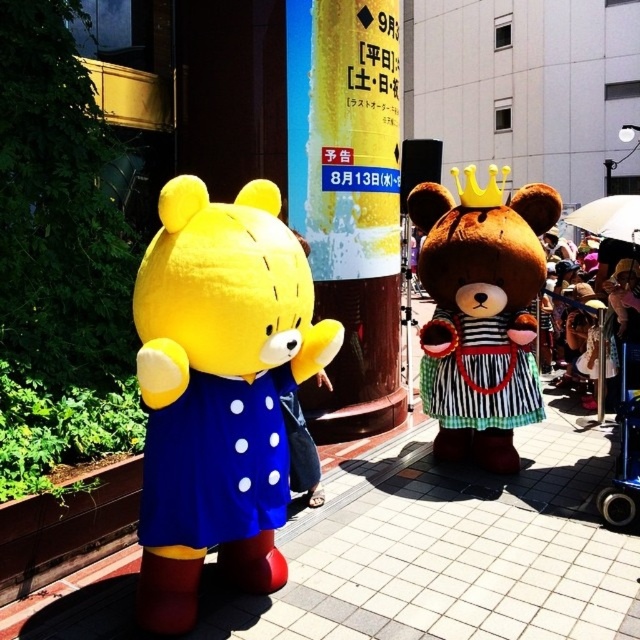
Does yellow plush bear at left appear on the left side of blue metallic baby carriage at lower right?

Indeed, yellow plush bear at left is positioned on the left side of blue metallic baby carriage at lower right.

Is yellow plush bear at left below blue metallic baby carriage at lower right?

Indeed, yellow plush bear at left is positioned under blue metallic baby carriage at lower right.

Between point (236, 582) and point (632, 268), which one is positioned in front?

Point (236, 582) is more forward.

You are a GUI agent. You are given a task and a screenshot of the screen. Output one action in this format:
    pyautogui.click(x=<x>, y=<y>)
    Task: Click on the yellow plush bear at left
    
    Given the screenshot: What is the action you would take?
    pyautogui.click(x=218, y=390)

Who is positioned more to the right, yellow plush bear at left or blue fabric dress at left?

Positioned to the right is yellow plush bear at left.

At what (x,y) coordinates should I click in order to perform the action: click on yellow plush bear at left. Please return your answer as a coordinate pair (x, y). Looking at the image, I should click on (218, 390).

Find the location of a particular element. This screenshot has width=640, height=640. yellow plush bear at left is located at coordinates (218, 390).

Describe the element at coordinates (451, 548) in the screenshot. I see `smooth concrete pavement at center` at that location.

Can you confirm if smooth concrete pavement at center is wider than blue metallic baby carriage at lower right?

Yes, smooth concrete pavement at center is wider than blue metallic baby carriage at lower right.

Identify the location of smooth concrete pavement at center. The image size is (640, 640). (451, 548).

What are the coordinates of `smooth concrete pavement at center` in the screenshot? It's located at (451, 548).